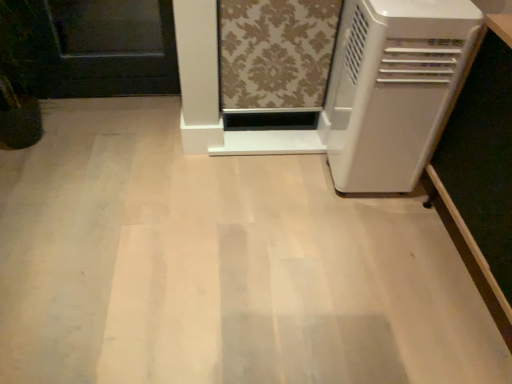
Question: Should I look upward or downward to see white plastic air conditioner at right?

Choices:
 (A) down
 (B) up

Answer: (B)